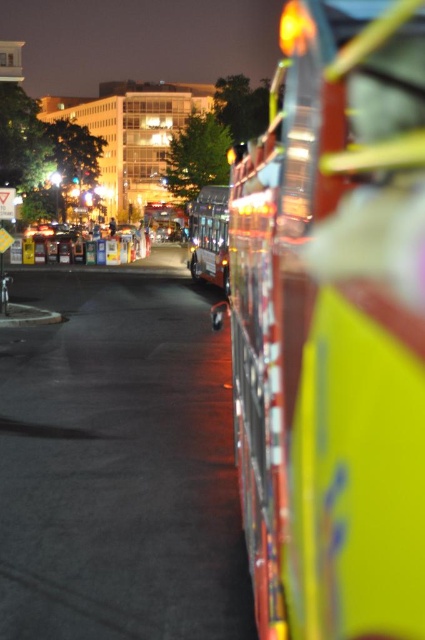
Question: Which point is closer to the camera taking this photo?

Choices:
 (A) (269, 616)
 (B) (226, 232)

Answer: (A)

Question: Which point is closer to the camera?

Choices:
 (A) (220, 225)
 (B) (360, 593)

Answer: (B)

Question: Can you confirm if metallic silver fire truck at right is wider than metallic silver bus at center?

Choices:
 (A) no
 (B) yes

Answer: (B)

Question: Is metallic silver fire truck at right further to camera compared to metallic silver bus at center?

Choices:
 (A) yes
 (B) no

Answer: (B)

Question: Is metallic silver fire truck at right to the left of metallic silver bus at center from the viewer's perspective?

Choices:
 (A) yes
 (B) no

Answer: (A)